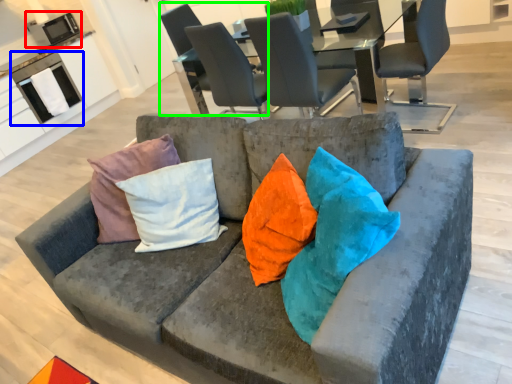
Question: Based on their relative distances, which object is nearer to appliance (highlighted by a red box)? Choose from appliance (highlighted by a blue box) and chair (highlighted by a green box).

Choices:
 (A) appliance
 (B) chair

Answer: (A)